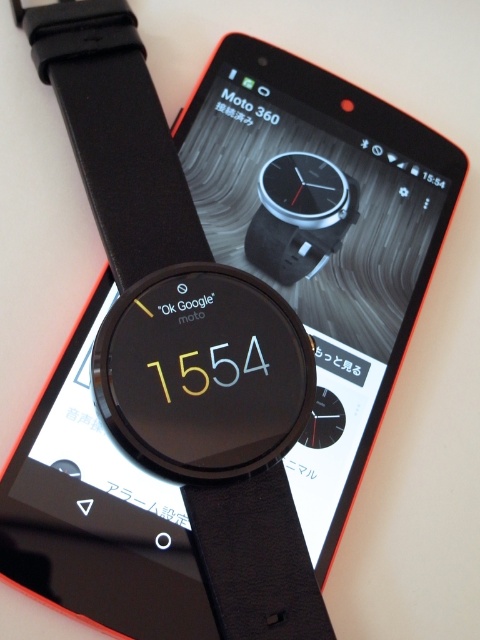
You are a delivery person who needs to place a black leather strap at center and a black matte watch at center into a box that is 10 inches long. Can both items fit in the box if placed side by side?

The black leather strap at center is 9.42 inches from black matte watch at center, so yes, both items can fit into the 10 inch box when placed side by side since the total distance between them is less than the box length.

You are trying to determine which object is taller between the black leather strap at center and the black matte watch at center. Based on the scene, which one is taller?

The black leather strap at center is taller than the black matte watch at center according to the description.

You are trying to locate the point marked as point [118,138] in the image. According to the scene description, where is this point located?

The point [118,138] is located on the black leather strap at center.